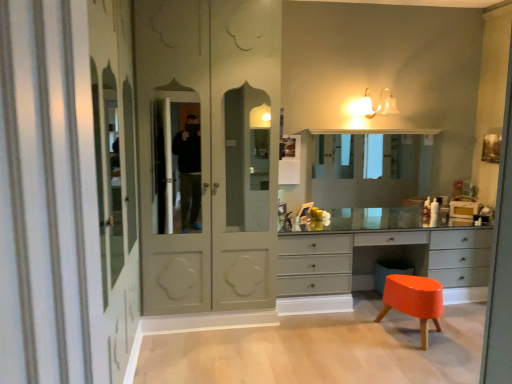
Question: Considering the positions of matte glass sconce at upper center and matte white wardrobe at center in the image, is matte glass sconce at upper center taller or shorter than matte white wardrobe at center?

Choices:
 (A) short
 (B) tall

Answer: (A)

Question: Based on their positions, is matte glass sconce at upper center located to the left or right of matte white wardrobe at center?

Choices:
 (A) left
 (B) right

Answer: (B)

Question: Estimate the real-world distances between objects in this image. Which object is closer to the orange glossy stool at lower right?

Choices:
 (A) matte glass sconce at upper center
 (B) matte white wardrobe at center
 (C) matte gray chest of drawers at center
 (D) clear glass medicine cabinet at center

Answer: (C)

Question: Which of these objects is positioned farthest from the matte gray chest of drawers at center?

Choices:
 (A) clear glass medicine cabinet at center
 (B) matte glass sconce at upper center
 (C) matte white wardrobe at center
 (D) orange glossy stool at lower right

Answer: (B)